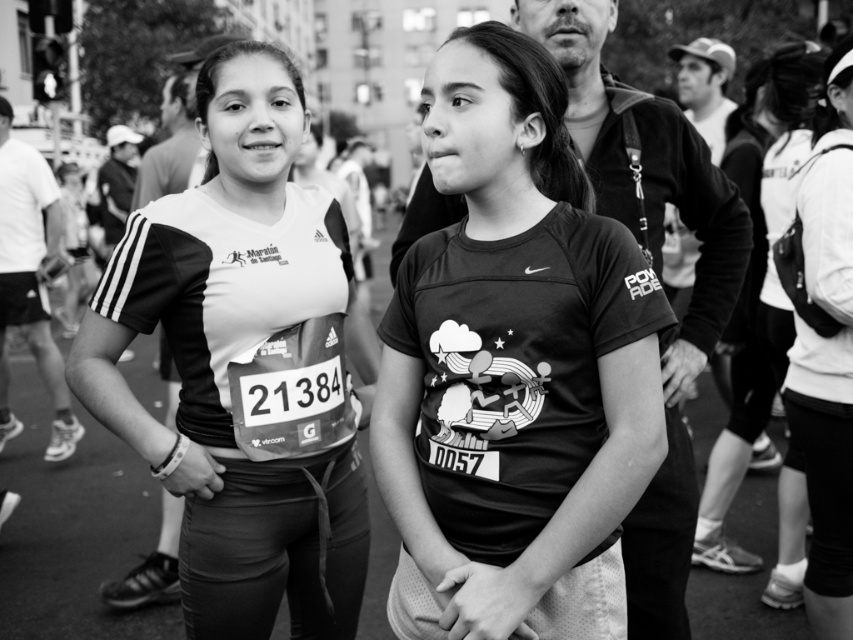
You are a photographer at the marathon event. You need to capture a photo where both the matte black shirt at center and the white cotton hoodie at right are clearly visible. Given their sizes, which clothing item will appear smaller in the photo?

The matte black shirt at center will appear smaller in the photo because it has a smaller size compared to the white cotton hoodie at right.